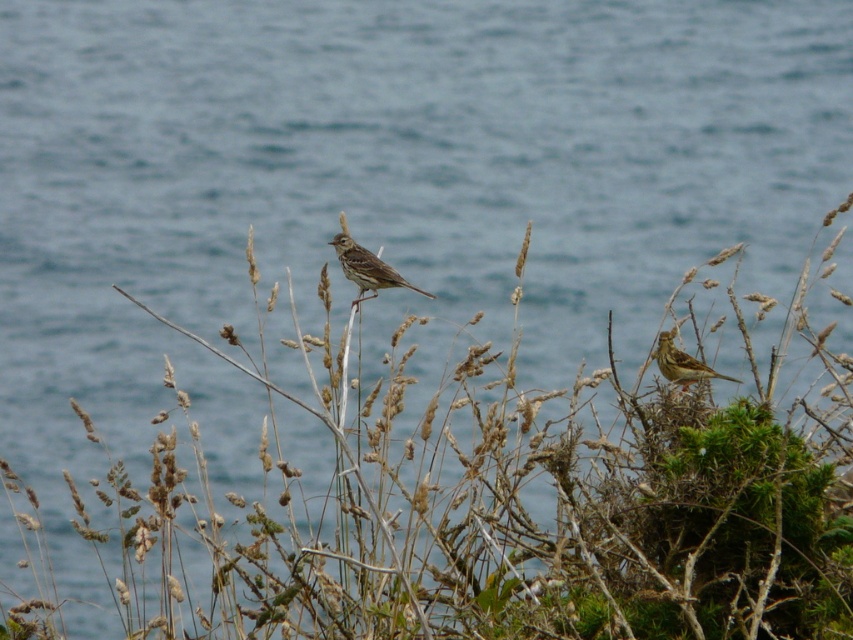
Who is positioned more to the left, brown speckled sparrow at center or brown speckled sparrow at right?

Positioned to the left is brown speckled sparrow at center.

Does point (357, 266) lie behind point (706, 374)?

Yes.

The image size is (853, 640). Identify the location of brown speckled sparrow at center. (367, 268).